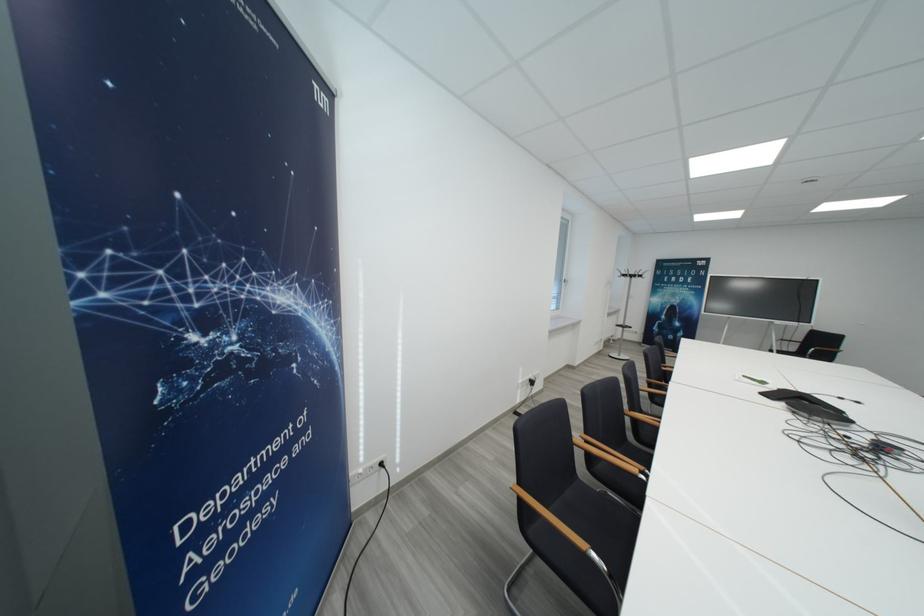
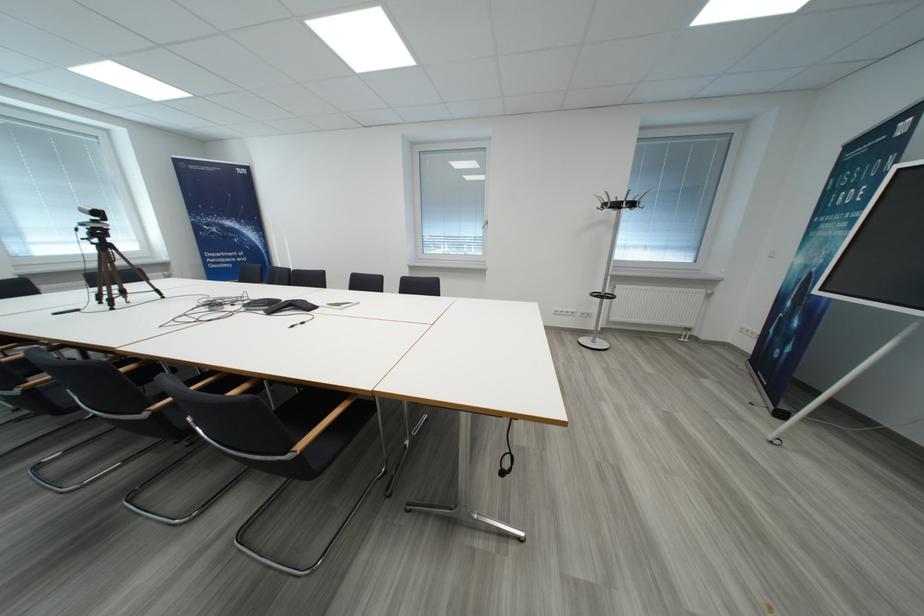
Locate, in the second image, the point that corresponds to point (663, 302) in the first image.

(807, 264)